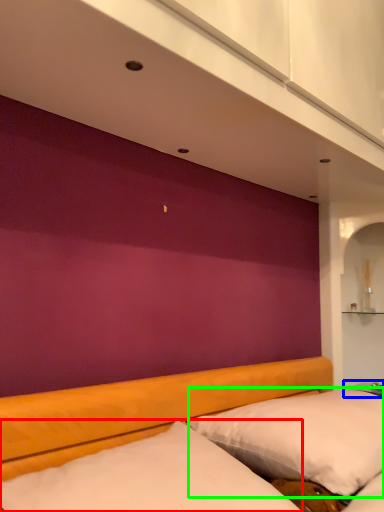
Question: Which object is the farthest from mattress (highlighted by a red box)? Choose among these: table (highlighted by a blue box) or pillow (highlighted by a green box).

Choices:
 (A) table
 (B) pillow

Answer: (A)